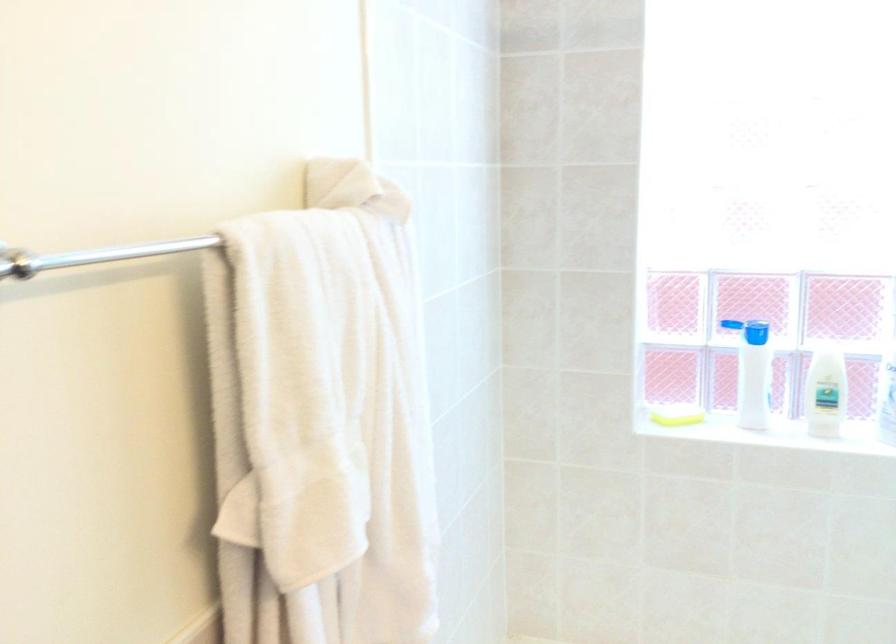
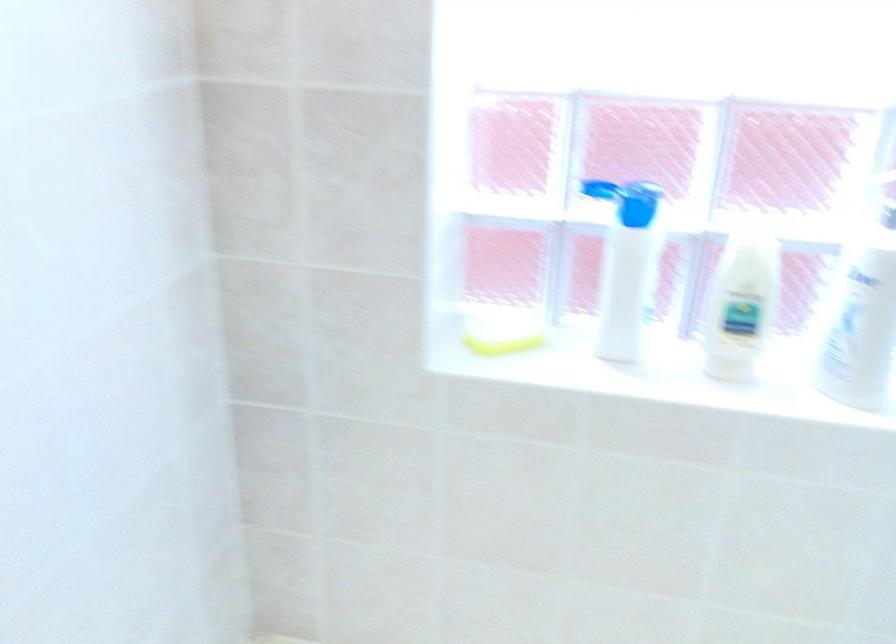
Locate, in the second image, the point that corresponds to (682,420) in the first image.

(503, 344)